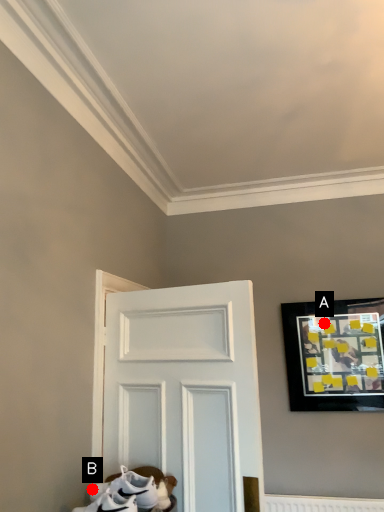
Question: Two points are circled on the image, labeled by A and B beside each circle. Which point is closer to the camera taking this photo?

Choices:
 (A) A is closer
 (B) B is closer

Answer: (B)